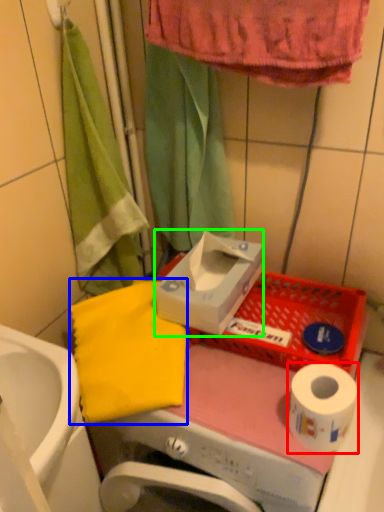
Question: Considering the real-world distances, which object is closest to toilet paper (highlighted by a red box)? beach towel (highlighted by a blue box) or carton (highlighted by a green box).

Choices:
 (A) beach towel
 (B) carton

Answer: (B)